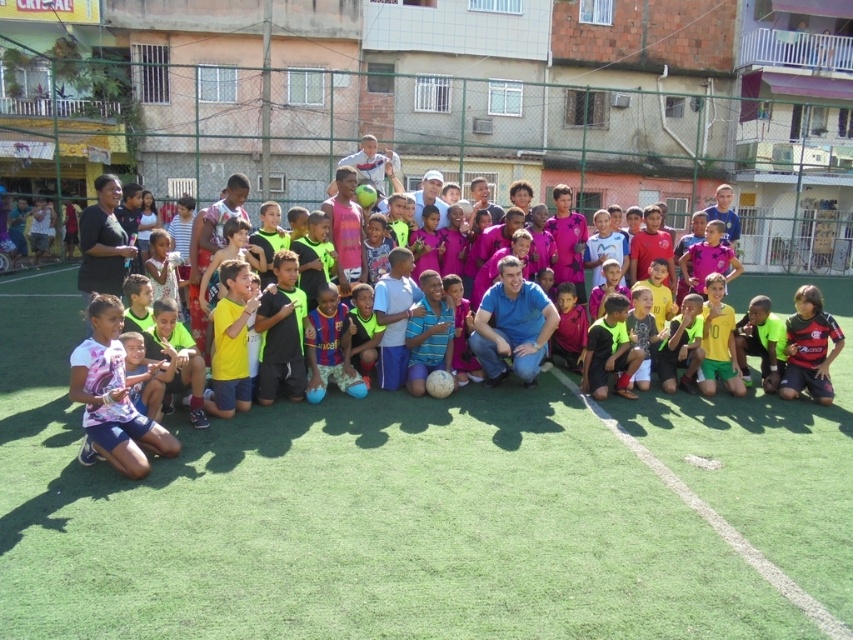
Question: Among these points, which one is farthest from the camera?

Choices:
 (A) (604, 326)
 (B) (822, 280)

Answer: (B)

Question: Is blue jersey at center closer to the viewer compared to yellow jersey at lower center?

Choices:
 (A) yes
 (B) no

Answer: (A)

Question: Which object is closer to the camera taking this photo?

Choices:
 (A) striped cotton shirt at center
 (B) black jersey at center
 (C) green artificial turf at center

Answer: (C)

Question: Is blue jersey at center wider than yellow jersey at lower center?

Choices:
 (A) no
 (B) yes

Answer: (A)

Question: Can you confirm if pink fabric football team at center is positioned below yellow jersey at lower center?

Choices:
 (A) yes
 (B) no

Answer: (B)

Question: Which object is closer to the camera taking this photo?

Choices:
 (A) striped cotton shirt at center
 (B) black jersey at center
 (C) pink jersey at lower left

Answer: (C)